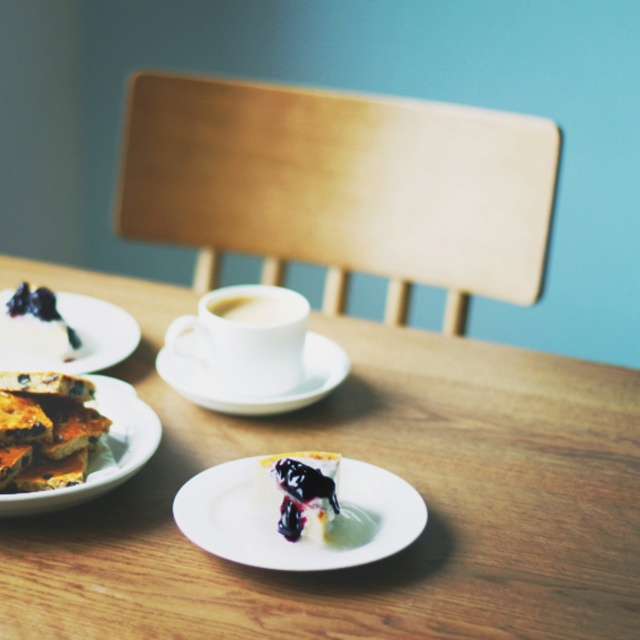
Question: Which of these objects is positioned farthest from the white matte plate at lower left?

Choices:
 (A) semi-glossy white cake with blueberry topping at lower center
 (B) blueberry pie at lower left
 (C) wooden table at center

Answer: (A)

Question: Does wooden table at center come behind white matte plate at lower left?

Choices:
 (A) no
 (B) yes

Answer: (A)

Question: Can you confirm if white glossy plate at center is smaller than semi-glossy white cake with blueberry topping at lower center?

Choices:
 (A) no
 (B) yes

Answer: (A)

Question: Is matte brown plate at lower left closer to camera compared to blueberry pie at lower left?

Choices:
 (A) no
 (B) yes

Answer: (B)

Question: Estimate the real-world distances between objects in this image. Which object is closer to the blueberry pie at lower left?

Choices:
 (A) white ceramic saucer at center
 (B) wooden table at center

Answer: (A)

Question: Estimate the real-world distances between objects in this image. Which object is closer to the white glossy cup at center?

Choices:
 (A) white glossy plate at center
 (B) matte brown plate at lower left

Answer: (B)